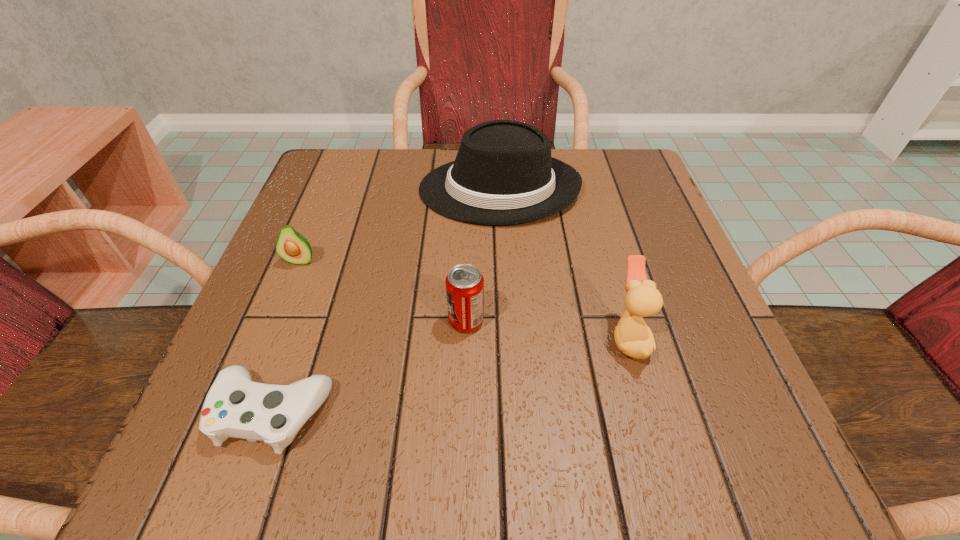
In the image, there is a desktop. At what (x,y) coordinates should I click in order to perform the action: click on vacant region at the near right corner. Please return your answer as a coordinate pair (x, y). Looking at the image, I should click on (678, 442).

Identify the location of vacant region between the fedora and the second farthest object. The height and width of the screenshot is (540, 960). (399, 225).

You are a GUI agent. You are given a task and a screenshot of the screen. Output one action in this format:
    pyautogui.click(x=<x>, y=<y>)
    Task: Click on the vacant space that is in between the control and the duck
    
    Given the screenshot: What is the action you would take?
    pyautogui.click(x=450, y=375)

Image resolution: width=960 pixels, height=540 pixels. Find the location of `vacant region between the control and the soda can`. vacant region between the control and the soda can is located at coordinates (370, 367).

This screenshot has height=540, width=960. I want to click on free spot between the control and the fedora, so click(386, 301).

Where is `free spot between the duck and the fedora`? The height and width of the screenshot is (540, 960). free spot between the duck and the fedora is located at coordinates click(x=564, y=263).

At what (x,y) coordinates should I click in order to perform the action: click on free area in between the duck and the farthest object. Please return your answer as a coordinate pair (x, y). This screenshot has height=540, width=960. Looking at the image, I should click on (564, 263).

In order to click on empty space between the farthest object and the soda can in this screenshot , I will do `click(483, 255)`.

Locate an element on the screen. The image size is (960, 540). vacant region between the shortest object and the duck is located at coordinates pyautogui.click(x=450, y=375).

Identify the location of free space between the soda can and the farthest object. The width and height of the screenshot is (960, 540). (483, 255).